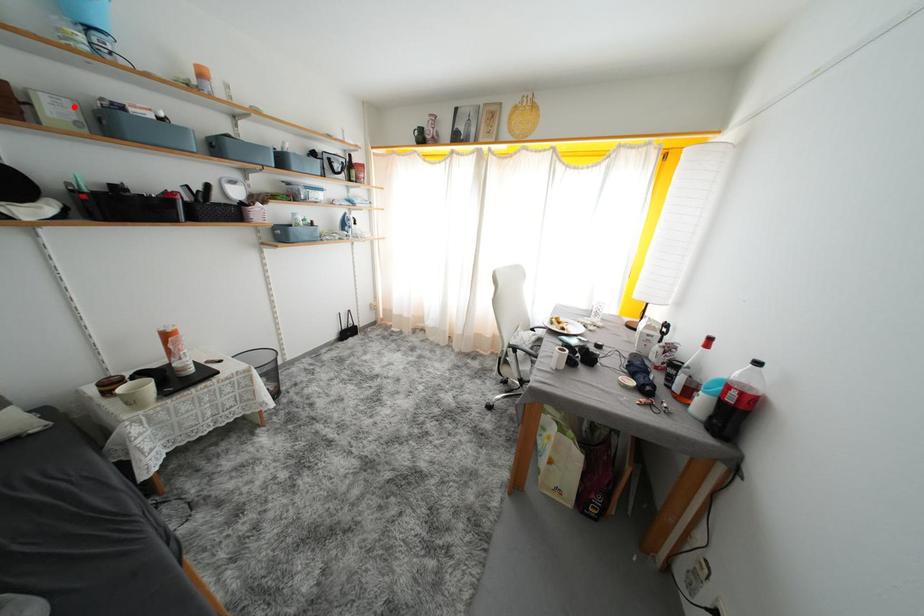
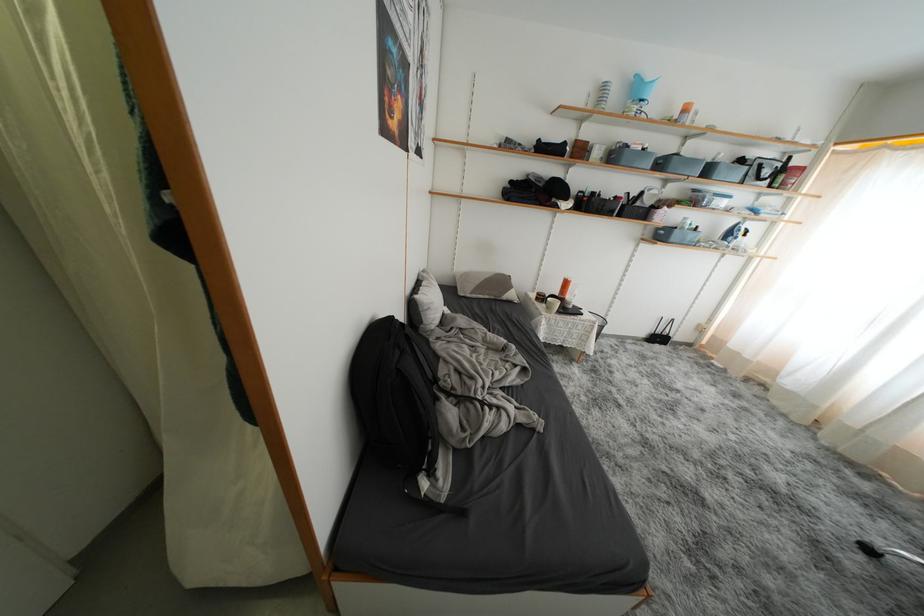
Question: I am providing you with two images of the same scene from different viewpoints. In image1, a red point is highlighted. Considering the same 3D point in image2, which of the following is correct?

Choices:
 (A) It is closer
 (B) It is farther

Answer: (A)